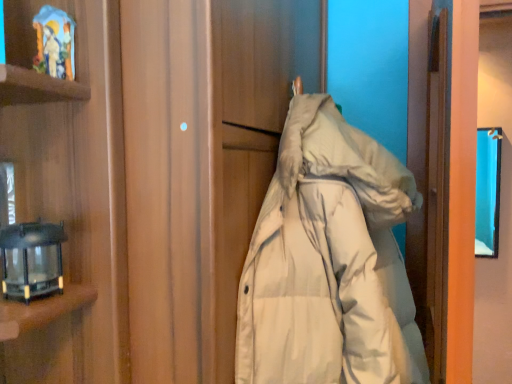
Question: Is black glass lantern at left oriented away from white down jacket at center?

Choices:
 (A) no
 (B) yes

Answer: (A)

Question: Does black glass lantern at left appear on the right side of white down jacket at center?

Choices:
 (A) no
 (B) yes

Answer: (A)

Question: Does black glass lantern at left lie in front of white down jacket at center?

Choices:
 (A) yes
 (B) no

Answer: (B)

Question: Does black glass lantern at left turn towards white down jacket at center?

Choices:
 (A) no
 (B) yes

Answer: (A)

Question: Would you say black glass lantern at left is outside white down jacket at center?

Choices:
 (A) yes
 (B) no

Answer: (A)

Question: From a real-world perspective, is black glass lantern at left over white down jacket at center?

Choices:
 (A) yes
 (B) no

Answer: (A)

Question: Can you confirm if white down jacket at center is shorter than black glass lantern at left?

Choices:
 (A) yes
 (B) no

Answer: (B)

Question: From a real-world perspective, is white down jacket at center positioned over black glass lantern at left based on gravity?

Choices:
 (A) yes
 (B) no

Answer: (B)

Question: Is white down jacket at center positioned behind black glass lantern at left?

Choices:
 (A) no
 (B) yes

Answer: (A)

Question: Is white down jacket at center at the right side of black glass lantern at left?

Choices:
 (A) no
 (B) yes

Answer: (B)

Question: Does white down jacket at center have a lesser width compared to black glass lantern at left?

Choices:
 (A) yes
 (B) no

Answer: (B)

Question: Is white down jacket at center oriented away from black glass lantern at left?

Choices:
 (A) yes
 (B) no

Answer: (B)

Question: Visually, is white down jacket at center positioned to the left or to the right of black glass lantern at left?

Choices:
 (A) right
 (B) left

Answer: (A)